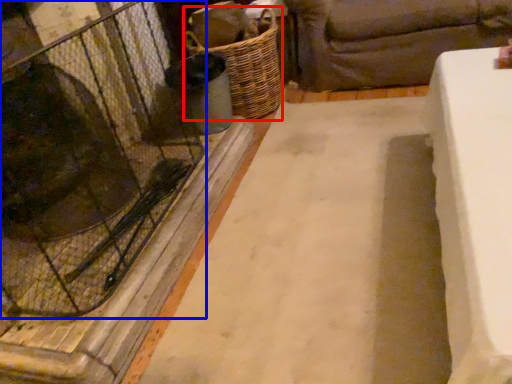
Question: Which of the following is the closest to the observer, basket (highlighted by a red box) or glass door (highlighted by a blue box)?

Choices:
 (A) basket
 (B) glass door

Answer: (B)